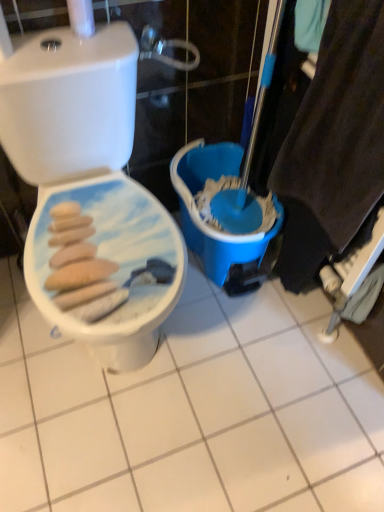
This screenshot has height=512, width=384. I want to click on white glossy ceramic tile at center, so click(x=191, y=411).

At what (x,y) coordinates should I click in order to perform the action: click on blue plastic bucket at center. Please return your answer as a coordinate pair (x, y). Looking at the image, I should click on (201, 217).

Measure the distance between point [44,200] and camera.

A distance of 3.47 feet exists between point [44,200] and camera.

Where is `white glossy ceramic tile at center`? The height and width of the screenshot is (512, 384). white glossy ceramic tile at center is located at coordinates (191, 411).

Is white glossy ceramic tile at center positioned behind blue plastic bucket at center?

No, it is not.

Could you tell me if white glossy ceramic tile at center is turned towards blue plastic bucket at center?

No, white glossy ceramic tile at center is not facing towards blue plastic bucket at center.

Between white glossy ceramic tile at center and blue plastic bucket at center, which one has less height?

Standing shorter between the two is white glossy ceramic tile at center.

Does white glossy ceramic tile at center have a smaller size compared to blue plastic bucket at center?

Yes, white glossy ceramic tile at center is smaller than blue plastic bucket at center.

Is blue plastic bucket at center smaller than white glossy ceramic tile at center?

No, blue plastic bucket at center is not smaller than white glossy ceramic tile at center.

In terms of height, does blue plastic bucket at center look taller or shorter compared to white glossy ceramic tile at center?

blue plastic bucket at center is taller than white glossy ceramic tile at center.

Could you tell me if blue plastic bucket at center is facing white glossy ceramic tile at center?

No, blue plastic bucket at center is not facing towards white glossy ceramic tile at center.

Is blue plastic bucket at center thinner than white glossy ceramic tile at center?

Indeed, blue plastic bucket at center has a lesser width compared to white glossy ceramic tile at center.

Who is more distant, white glossy toilet seat at left or white glossy ceramic tile at center?

white glossy ceramic tile at center is further from the camera.

Can you confirm if white glossy toilet seat at left is wider than white glossy ceramic tile at center?

No, white glossy toilet seat at left is not wider than white glossy ceramic tile at center.

Considering the positions of points (55, 96) and (297, 420), is point (55, 96) farther from camera compared to point (297, 420)?

No, (55, 96) is closer to viewer.

Looking at this image, from the image's perspective, between white glossy toilet seat at left and white glossy ceramic tile at center, who is located below?

white glossy ceramic tile at center.

Is the depth of white glossy ceramic tile at center greater than that of white glossy toilet seat at left?

Yes, the depth of white glossy ceramic tile at center is greater than that of white glossy toilet seat at left.

Between point (98, 497) and point (116, 169), which one is positioned behind?

The point (116, 169) is farther.

Is white glossy ceramic tile at center aimed at white glossy toilet seat at left?

No, white glossy ceramic tile at center is not facing towards white glossy toilet seat at left.

Which is more to the right, white glossy ceramic tile at center or white glossy toilet seat at left?

Positioned to the right is white glossy ceramic tile at center.

From a real-world perspective, is white glossy toilet seat at left on blue plastic bucket at center?

Yes, from a real-world perspective, white glossy toilet seat at left is over blue plastic bucket at center

In terms of width, does white glossy toilet seat at left look wider or thinner when compared to blue plastic bucket at center?

white glossy toilet seat at left is wider than blue plastic bucket at center.

You are a GUI agent. You are given a task and a screenshot of the screen. Output one action in this format:
    pyautogui.click(x=<x>, y=<y>)
    Task: Click on the potty on the right of white glossy toilet seat at left
    The height and width of the screenshot is (512, 384).
    Given the screenshot: What is the action you would take?
    pyautogui.click(x=201, y=217)

Considering the relative sizes of white glossy toilet seat at left and blue plastic bucket at center in the image provided, is white glossy toilet seat at left bigger than blue plastic bucket at center?

Yes, white glossy toilet seat at left is bigger than blue plastic bucket at center.

From the image's perspective, which is below, blue plastic bucket at center or white glossy toilet seat at left?

From the image's view, white glossy toilet seat at left is below.

Would you say blue plastic bucket at center is inside or outside white glossy toilet seat at left?

blue plastic bucket at center is located beyond the bounds of white glossy toilet seat at left.

Which of these two, blue plastic bucket at center or white glossy toilet seat at left, is wider?

white glossy toilet seat at left.

Is there a large distance between blue plastic bucket at center and white glossy toilet seat at left?

Actually, blue plastic bucket at center and white glossy toilet seat at left are a little close together.

There is a white glossy ceramic tile at center. Where is `potty above it (from a real-world perspective)`? The image size is (384, 512). potty above it (from a real-world perspective) is located at coordinates (201, 217).

Where is `ceramic tile below the blue plastic bucket at center (from the image's perspective)`? This screenshot has height=512, width=384. ceramic tile below the blue plastic bucket at center (from the image's perspective) is located at coordinates (191, 411).

From the image, which object appears to be nearer to white glossy toilet seat at left, white glossy ceramic tile at center or blue plastic bucket at center?

blue plastic bucket at center is closer to white glossy toilet seat at left.

Based on the photo, which object lies further to the anchor point white glossy toilet seat at left, blue plastic bucket at center or white glossy ceramic tile at center?

white glossy ceramic tile at center is positioned further to the anchor white glossy toilet seat at left.

Based on their spatial positions, is blue plastic bucket at center or white glossy toilet seat at left closer to white glossy ceramic tile at center?

blue plastic bucket at center lies closer to white glossy ceramic tile at center than the other object.

Considering their positions, is white glossy toilet seat at left positioned further to blue plastic bucket at center than white glossy ceramic tile at center?

white glossy ceramic tile at center is positioned further to the anchor blue plastic bucket at center.

Based on their spatial positions, is white glossy toilet seat at left or blue plastic bucket at center closer to white glossy ceramic tile at center?

blue plastic bucket at center lies closer to white glossy ceramic tile at center than the other object.

Based on their spatial positions, is white glossy ceramic tile at center or white glossy toilet seat at left further from blue plastic bucket at center?

white glossy ceramic tile at center.

In order to click on ceramic tile between white glossy toilet seat at left and blue plastic bucket at center along the z-axis in this screenshot , I will do `click(191, 411)`.